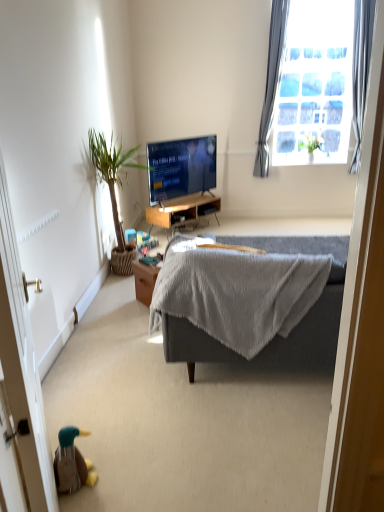
Where is `free space in front of green leafy plant at left, the 1th houseplant viewed from the left`? free space in front of green leafy plant at left, the 1th houseplant viewed from the left is located at coordinates [x=114, y=300].